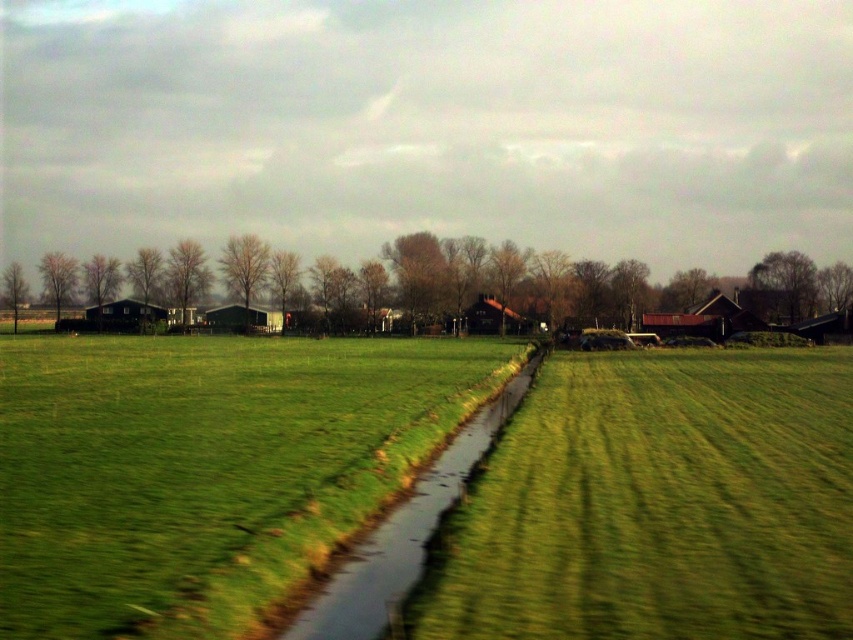
You are a farmer checking the irrigation system. You notice the green grassy field at center and the green grassy stream at center. Which one is positioned higher in the landscape?

The green grassy field at center is located above the green grassy stream at center, so it is positioned higher in the landscape.

You are a farmer checking the growth of your crops. You notice two areas in your field, the green grassy field at center and the green grassy stream at center. Which area has taller grass?

The green grassy field at center is much taller than the green grassy stream at center.